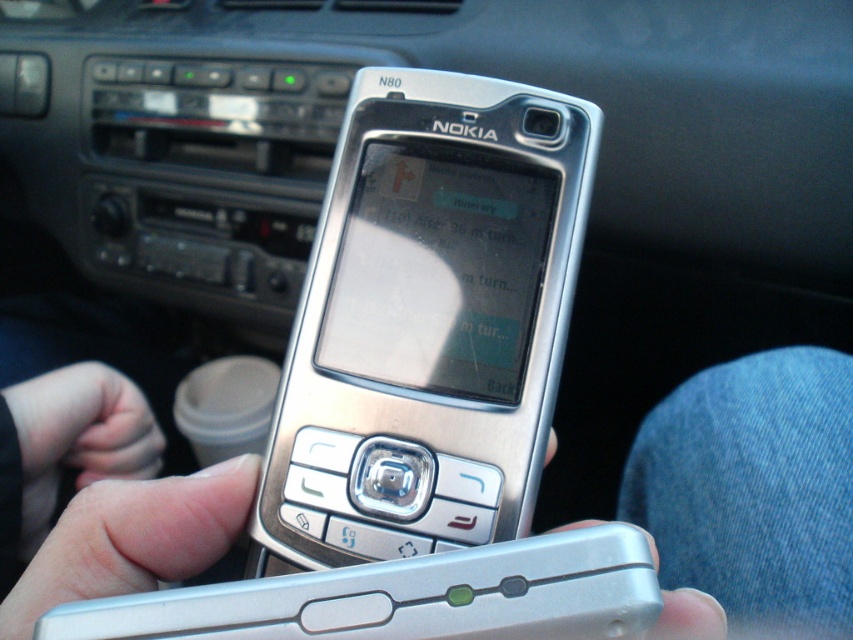
Question: Does silver metallic nokia phone at center appear on the right side of silver metallic phone at center?

Choices:
 (A) no
 (B) yes

Answer: (A)

Question: Is silver metallic nokia phone at center closer to the viewer compared to silver metallic phone at center?

Choices:
 (A) no
 (B) yes

Answer: (B)

Question: Among these objects, which one is nearest to the camera?

Choices:
 (A) silver metallic nokia phone at center
 (B) silver metallic phone at center

Answer: (A)

Question: Is silver metallic nokia phone at center to the left of silver metallic phone at center from the viewer's perspective?

Choices:
 (A) no
 (B) yes

Answer: (B)